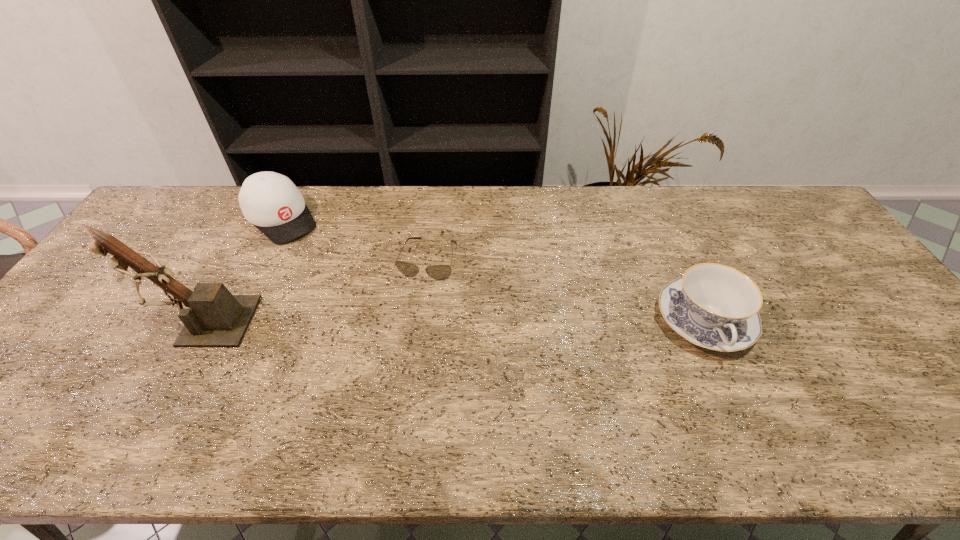
The height and width of the screenshot is (540, 960). What are the coordinates of `figurine` in the screenshot? It's located at (217, 318).

Locate an element on the screen. The width and height of the screenshot is (960, 540). the second shortest object is located at coordinates (714, 306).

Where is `chinaware`? Image resolution: width=960 pixels, height=540 pixels. chinaware is located at coordinates (714, 306).

This screenshot has width=960, height=540. In order to click on sunglasses in this screenshot , I will do `click(439, 272)`.

Find the location of a particular element. the shortest object is located at coordinates (439, 272).

At what (x,y) coordinates should I click in order to perform the action: click on baseball cap. Please return your answer as a coordinate pair (x, y). This screenshot has height=540, width=960. Looking at the image, I should click on (270, 201).

At what (x,y) coordinates should I click in order to perform the action: click on free spot located 0.230m on the front-facing side of the figurine. Please return your answer as a coordinate pair (x, y). The image size is (960, 540). Looking at the image, I should click on (62, 321).

This screenshot has width=960, height=540. I want to click on free location located on the front-facing side of the figurine, so click(x=97, y=321).

Locate an element on the screen. The height and width of the screenshot is (540, 960). vacant space located on the front-facing side of the shortest object is located at coordinates (388, 392).

Locate an element on the screen. The height and width of the screenshot is (540, 960). vacant space positioned 0.240m on the front-facing side of the shortest object is located at coordinates (400, 352).